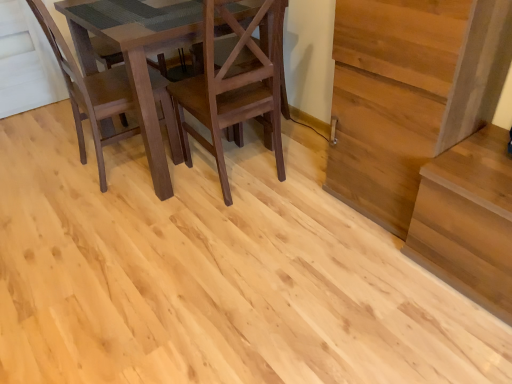
Question: Should I look upward or downward to see dark brown wood chair at left, which is the 1th chair from left to right?

Choices:
 (A) down
 (B) up

Answer: (B)

Question: Would you say light brown wood stairs at right is part of matte brown chair at center, acting as the second chair starting from the left,'s contents?

Choices:
 (A) no
 (B) yes

Answer: (A)

Question: Is matte brown chair at center, which is the first chair in right-to-left order, placed right next to light brown wood stairs at right?

Choices:
 (A) yes
 (B) no

Answer: (B)

Question: Does matte brown chair at center, which is the first chair in right-to-left order, appear on the left side of light brown wood stairs at right?

Choices:
 (A) yes
 (B) no

Answer: (A)

Question: Is matte brown chair at center, acting as the second chair starting from the left, taller than light brown wood stairs at right?

Choices:
 (A) yes
 (B) no

Answer: (B)

Question: Considering the relative positions of matte brown chair at center, which is the first chair in right-to-left order, and light brown wood stairs at right in the image provided, is matte brown chair at center, which is the first chair in right-to-left order, to the right of light brown wood stairs at right from the viewer's perspective?

Choices:
 (A) no
 (B) yes

Answer: (A)

Question: Does matte brown chair at center, which is the first chair in right-to-left order, have a larger size compared to light brown wood stairs at right?

Choices:
 (A) no
 (B) yes

Answer: (A)

Question: Is light brown wood stairs at right aimed at matte brown chair at center, acting as the second chair starting from the left?

Choices:
 (A) yes
 (B) no

Answer: (B)

Question: Considering the relative sizes of light brown wood stairs at right and matte brown chair at center, acting as the second chair starting from the left, in the image provided, is light brown wood stairs at right thinner than matte brown chair at center, acting as the second chair starting from the left,?

Choices:
 (A) no
 (B) yes

Answer: (B)

Question: Considering the relative sizes of light brown wood stairs at right and matte brown chair at center, which is the first chair in right-to-left order, in the image provided, is light brown wood stairs at right bigger than matte brown chair at center, which is the first chair in right-to-left order,?

Choices:
 (A) no
 (B) yes

Answer: (B)

Question: Does light brown wood stairs at right have a lesser height compared to matte brown chair at center, acting as the second chair starting from the left?

Choices:
 (A) no
 (B) yes

Answer: (A)

Question: Does light brown wood stairs at right have a greater height compared to matte brown chair at center, acting as the second chair starting from the left?

Choices:
 (A) no
 (B) yes

Answer: (B)

Question: Is matte brown chair at center, which is the first chair in right-to-left order, surrounded by light brown wood stairs at right?

Choices:
 (A) yes
 (B) no

Answer: (B)

Question: Is dark brown wood chair at left, which is the 2th chair in right-to-left order, next to matte brown chair at center, which is the first chair in right-to-left order, and touching it?

Choices:
 (A) yes
 (B) no

Answer: (B)